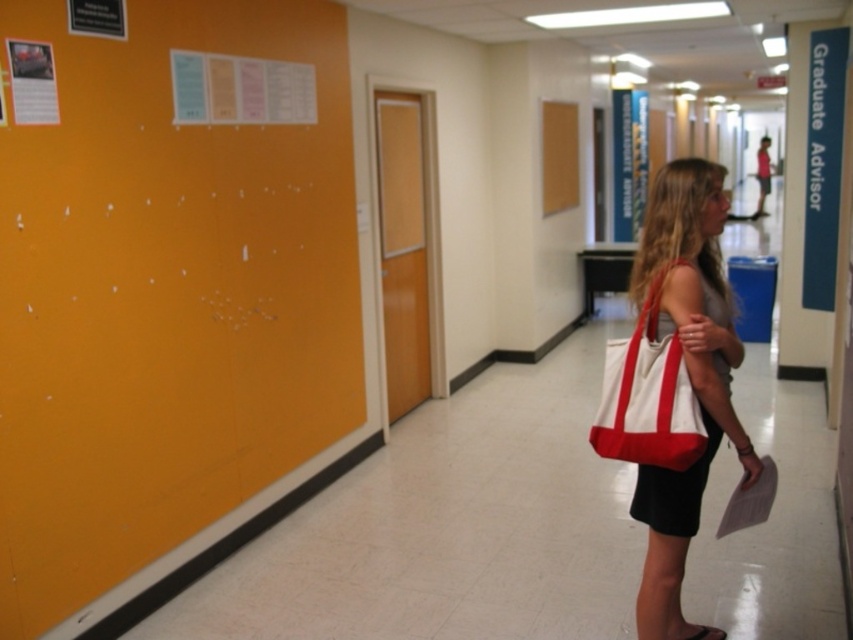
What is located at the coordinates point (x=686, y=369) in the image?

The point (x=686, y=369) is on the white canvas tote bag at center right.